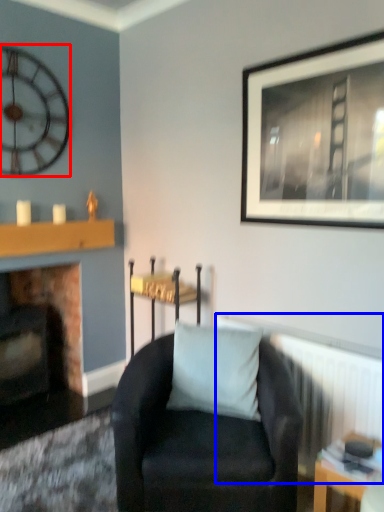
Question: Among these objects, which one is farthest to the camera, wall clock (highlighted by a red box) or radiator (highlighted by a blue box)?

Choices:
 (A) wall clock
 (B) radiator

Answer: (A)